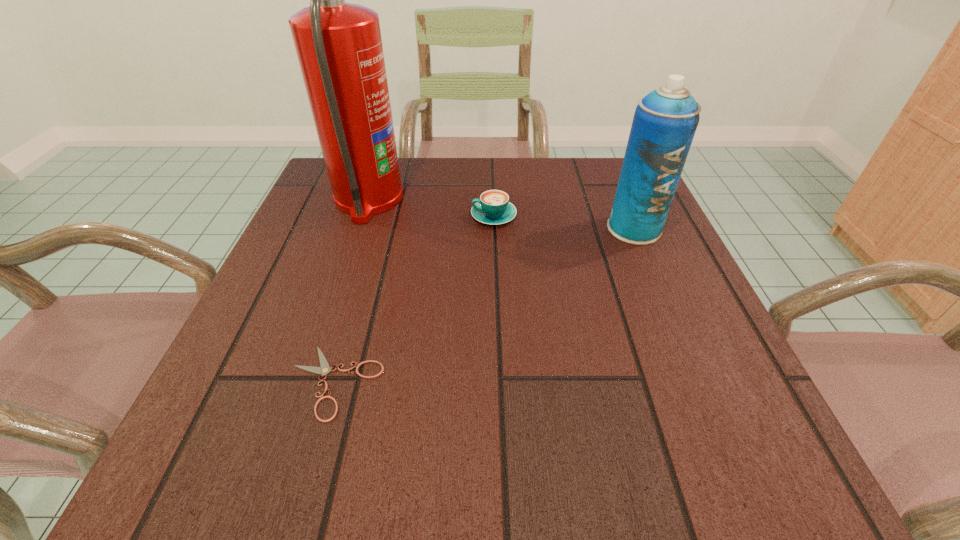
Locate an element on the screen. vacant position located 0.160m with the handle on the right side of the cappuccino is located at coordinates (397, 216).

Find the location of `free point located with the handle on the right side of the cappuccino`. free point located with the handle on the right side of the cappuccino is located at coordinates (361, 216).

You are a GUI agent. You are given a task and a screenshot of the screen. Output one action in this format:
    pyautogui.click(x=<x>, y=<y>)
    Task: Click on the vacant space situated 0.100m on the right of the shortest object
    Image resolution: width=960 pixels, height=540 pixels.
    Given the screenshot: What is the action you would take?
    pyautogui.click(x=449, y=382)

The image size is (960, 540). In order to click on fire extinguisher at the far edge in this screenshot , I will do [339, 47].

This screenshot has width=960, height=540. Find the location of `cappuccino that is at the far edge`. cappuccino that is at the far edge is located at coordinates (493, 208).

Find the location of a particular element. object positioned at the near edge is located at coordinates (324, 369).

This screenshot has width=960, height=540. In order to click on fire extinguisher that is at the left edge in this screenshot , I will do `click(339, 47)`.

Find the location of `shears present at the left edge`. shears present at the left edge is located at coordinates (324, 369).

You are a GUI agent. You are given a task and a screenshot of the screen. Output one action in this format:
    pyautogui.click(x=<x>, y=<y>)
    Task: Click on the object situated at the right edge
    Image resolution: width=960 pixels, height=540 pixels.
    Given the screenshot: What is the action you would take?
    pyautogui.click(x=665, y=121)

This screenshot has width=960, height=540. Identify the location of object positioned at the far left corner. (339, 47).